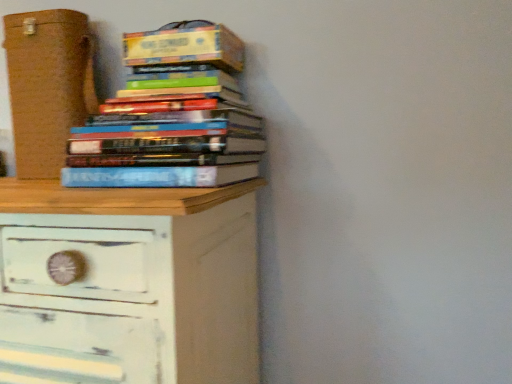
Question: Looking at their shapes, would you say hardcover books at upper center is wider or thinner than brown cardboard box at left?

Choices:
 (A) thin
 (B) wide

Answer: (B)

Question: In the image, is hardcover books at upper center on the left side or the right side of brown cardboard box at left?

Choices:
 (A) left
 (B) right

Answer: (B)

Question: Based on their relative distances, which object is farther from the hardcover book at upper left?

Choices:
 (A) brown cardboard box at left
 (B) hardcover books at upper center
 (C) white distressed wood chest of drawers at lower left

Answer: (C)

Question: Estimate the real-world distances between objects in this image. Which object is closer to the hardcover books at upper center?

Choices:
 (A) brown cardboard box at left
 (B) hardcover book at upper left
 (C) white distressed wood chest of drawers at lower left

Answer: (B)